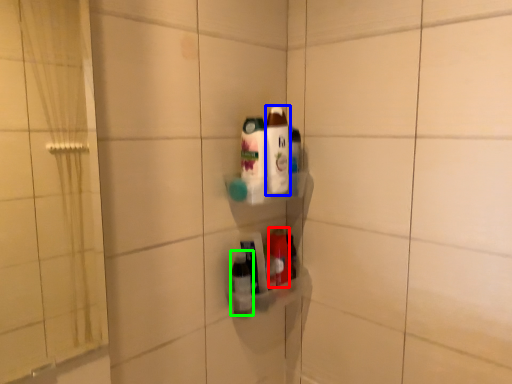
Question: Considering the real-world distances, which object is closest to bottle (highlighted by a red box)? bottle (highlighted by a blue box) or bottle (highlighted by a green box).

Choices:
 (A) bottle
 (B) bottle

Answer: (B)